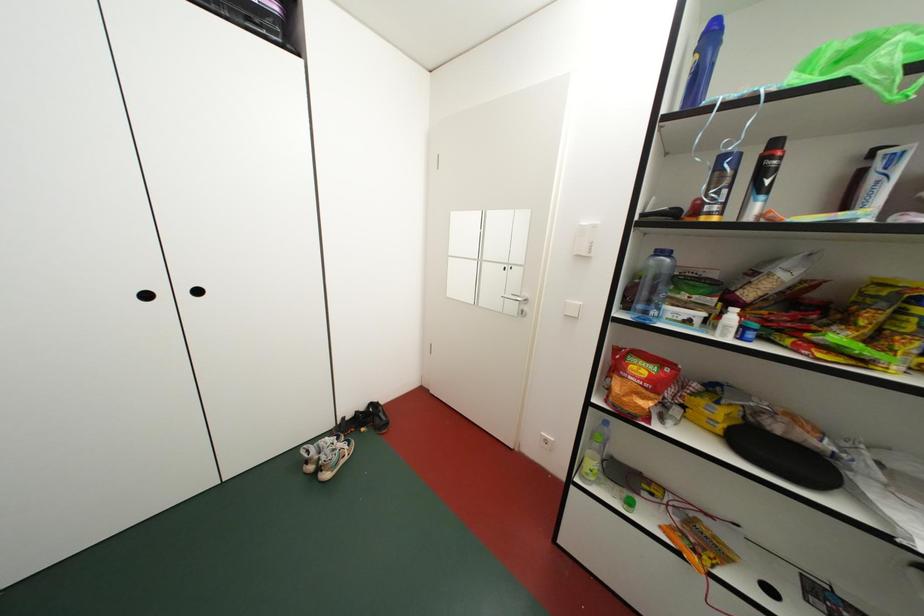
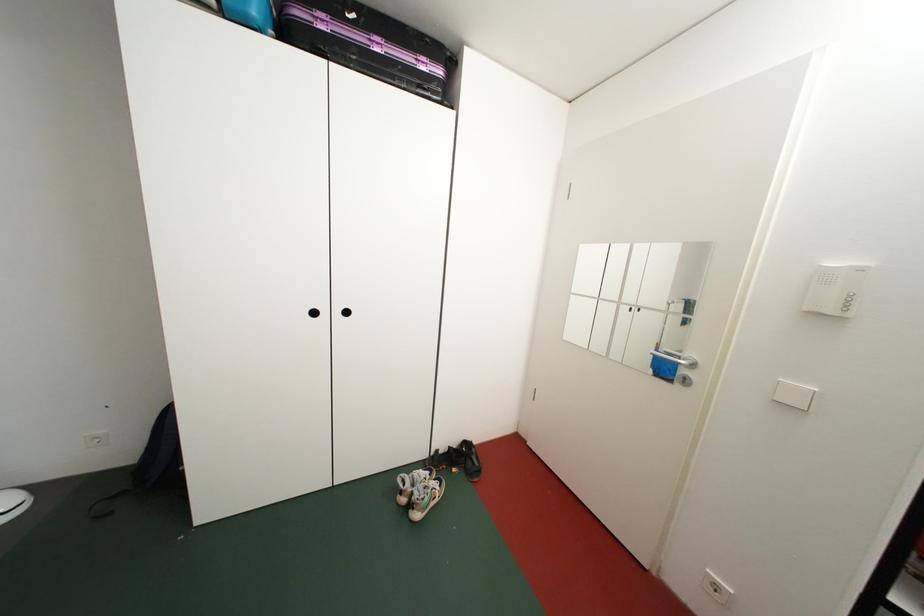
Question: Based on the continuous images, in which direction is the camera rotating? Reply with the corresponding letter.

Choices:
 (A) Left
 (B) Right
 (C) Up
 (D) Down

Answer: (A)